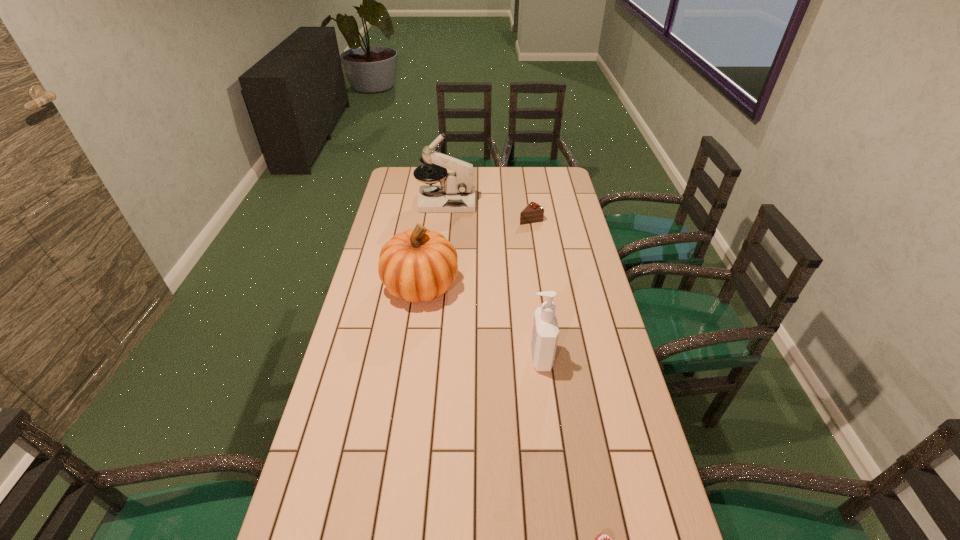
You are a GUI agent. You are given a task and a screenshot of the screen. Output one action in this format:
    pyautogui.click(x=<x>, y=<y>)
    Task: Click on the free space between the third nearest object and the fourth farthest object
    This screenshot has width=960, height=540.
    Given the screenshot: What is the action you would take?
    pyautogui.click(x=481, y=321)

Find the location of a particular element. The height and width of the screenshot is (540, 960). vacant region between the tallest object and the second shortest object is located at coordinates (489, 211).

The height and width of the screenshot is (540, 960). Find the location of `the closest object to the tallest object`. the closest object to the tallest object is located at coordinates (533, 212).

Identify which object is located as the second nearest to the shorter chocolate cake. Please provide its 2D coordinates. Your answer should be formatted as a tuple, i.e. [(x, y)], where the tuple contains the x and y coordinates of a point satisfying the conditions above.

[(418, 265)]

Identify which chocolate cake is the second closest to the pumpkin. Please provide its 2D coordinates. Your answer should be formatted as a tuple, i.e. [(x, y)], where the tuple contains the x and y coordinates of a point satisfying the conditions above.

[(600, 539)]

In order to click on vacant space that satisfies the following two spatial constraints: 1. on the back side of the taller chocolate cake; 2. on the right side of the third farthest object in this screenshot , I will do `click(431, 219)`.

Where is `free region that satisfies the following two spatial constraints: 1. at the eyepiece of the microscope; 2. on the back side of the fourth tallest object`? Image resolution: width=960 pixels, height=540 pixels. free region that satisfies the following two spatial constraints: 1. at the eyepiece of the microscope; 2. on the back side of the fourth tallest object is located at coordinates (444, 219).

At what (x,y) coordinates should I click in order to perform the action: click on vacant space that satisfies the following two spatial constraints: 1. at the eyepiece of the microscope; 2. on the back side of the taller chocolate cake. Please return your answer as a coordinate pair (x, y). Looking at the image, I should click on pos(444,219).